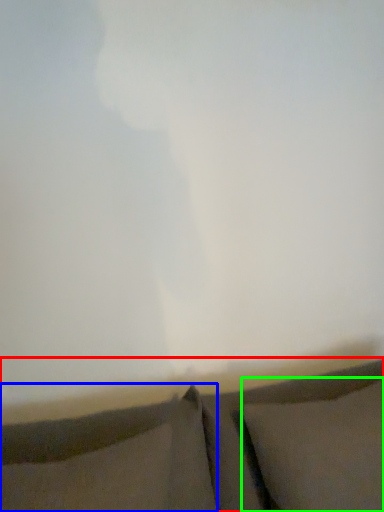
Question: Considering the real-world distances, which object is farthest from furniture (highlighted by a red box)? pillow (highlighted by a blue box) or pillow (highlighted by a green box)?

Choices:
 (A) pillow
 (B) pillow

Answer: (B)